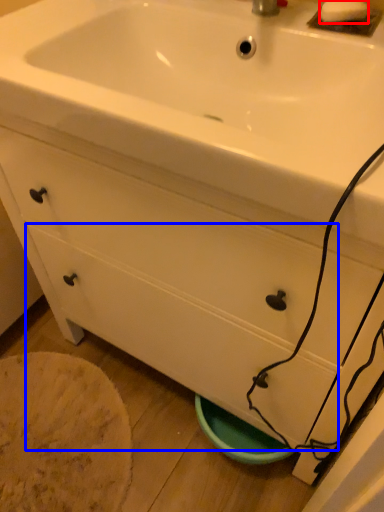
Question: Which object appears farthest to the camera in this image, soap (highlighted by a red box) or drawer (highlighted by a blue box)?

Choices:
 (A) soap
 (B) drawer

Answer: (B)